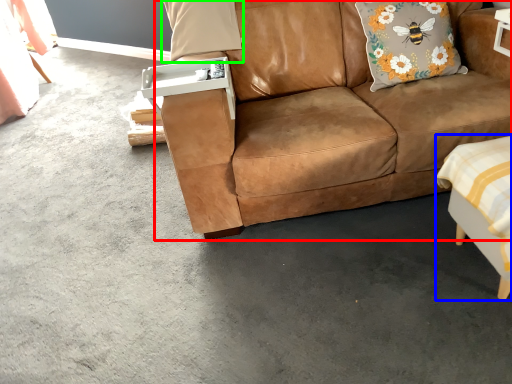
Question: Considering the real-world distances, which object is closest to studio couch (highlighted by a red box)? swivel chair (highlighted by a blue box) or pillow (highlighted by a green box).

Choices:
 (A) swivel chair
 (B) pillow

Answer: (A)